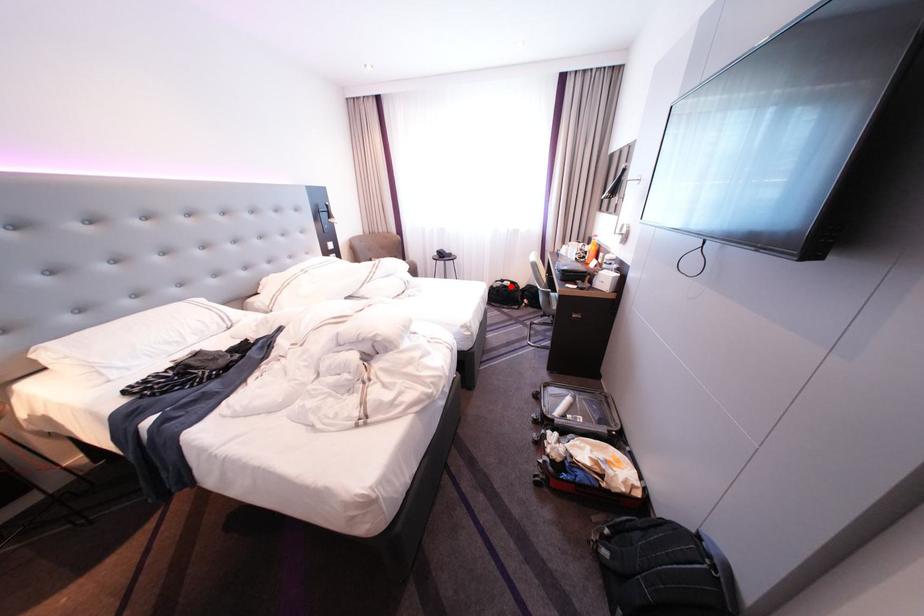
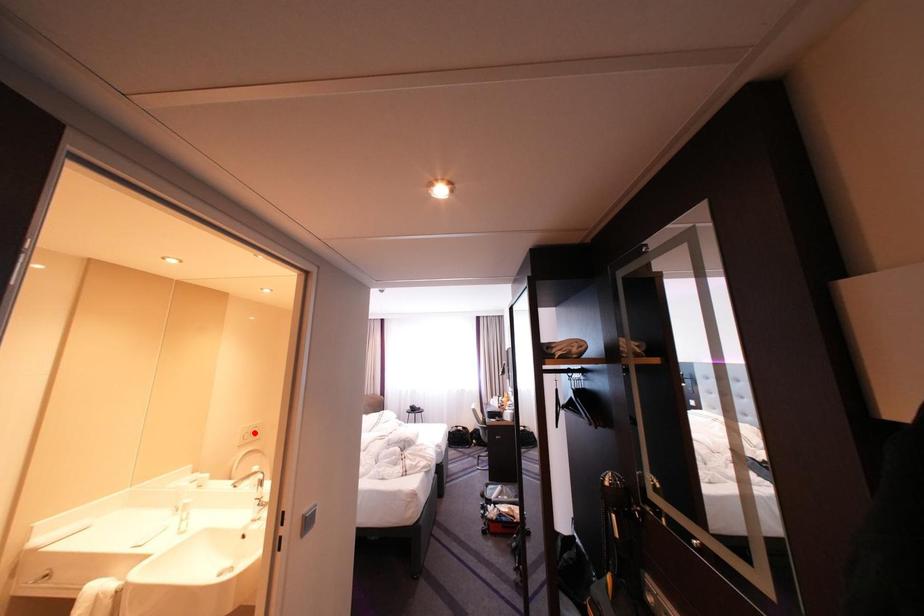
I am providing you with two images of the same scene from different viewpoints. A red point is marked on the first image and another point is marked on the second image. Are the points marked in image1 and image2 representing the same 3D position?

No